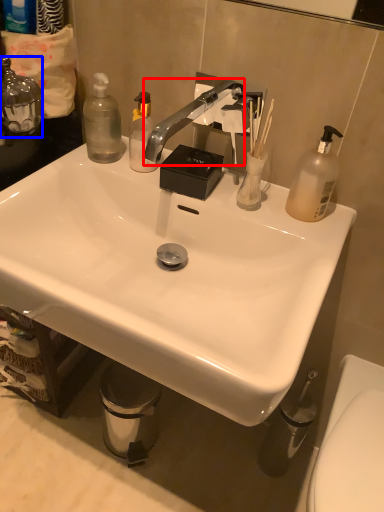
Question: Which object appears closest to the camera in this image, faucet (highlighted by a red box) or bottle (highlighted by a blue box)?

Choices:
 (A) faucet
 (B) bottle

Answer: (A)